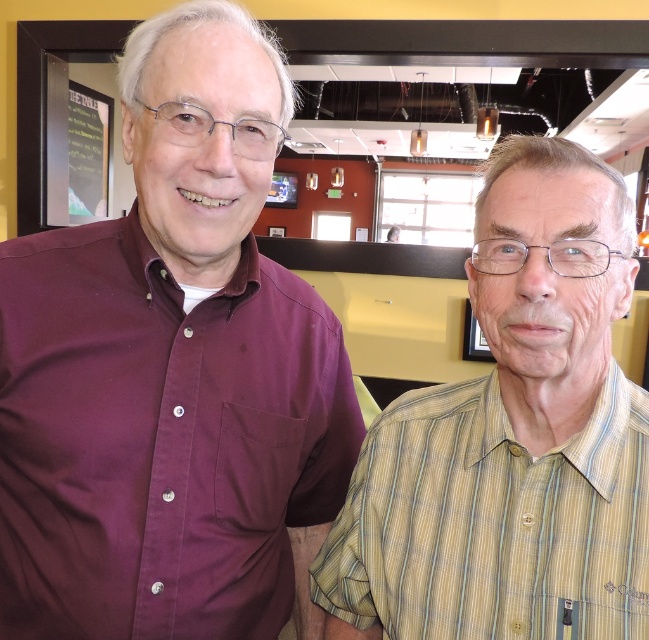
You are a customer in the restaurant and want to read the menu written on the chalkboards. Which chalkboard should you look at first if you want to see the green chalkboard at upper left before the black chalkboard at upper left?

The green chalkboard at upper left is to the right of the black chalkboard at upper left. Since you want to see the green one first, you should look at the black chalkboard at upper left first, then move to the right to the green chalkboard at upper left.

You are a photographer standing at the center of the room. You want to take a photo of the yellow striped shirt at right without including the person wearing it. Is it possible to do so given your current position?

The yellow striped shirt at right and viewer are 21.82 inches apart, so if the photographer is positioned at the center of the room, they can adjust their angle or zoom to capture just the yellow striped shirt at right without including the person, provided the distance allows for such framing.